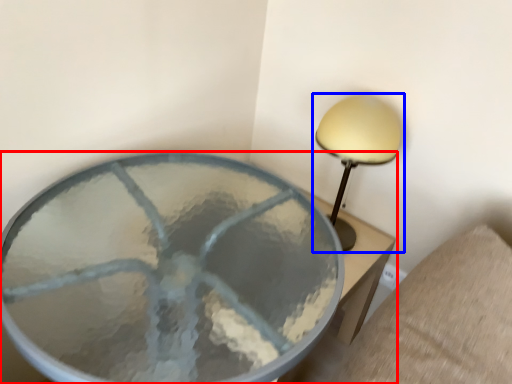
Question: Which object is closer to the camera taking this photo, table (highlighted by a red box) or lamp (highlighted by a blue box)?

Choices:
 (A) table
 (B) lamp

Answer: (A)